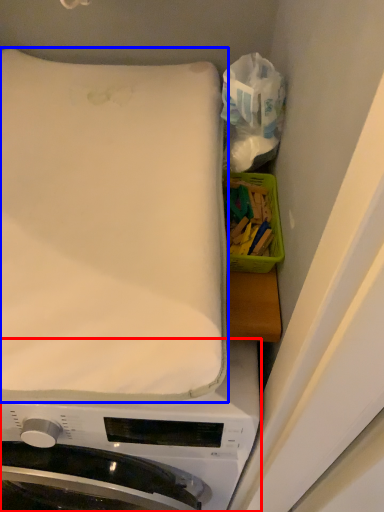
Question: Which point is closer to the camera, washing machine (highlighted by a red box) or mattress (highlighted by a blue box)?

Choices:
 (A) washing machine
 (B) mattress

Answer: (B)